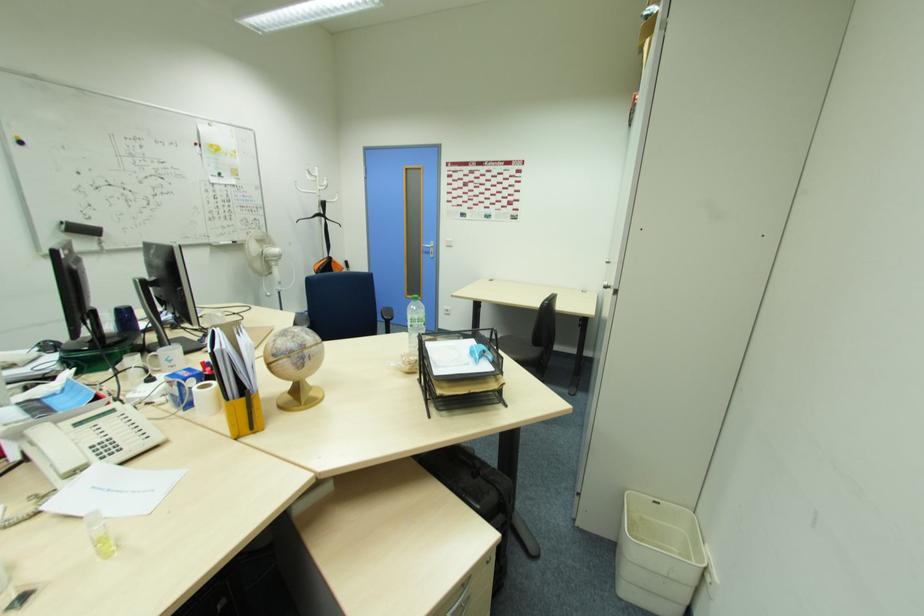
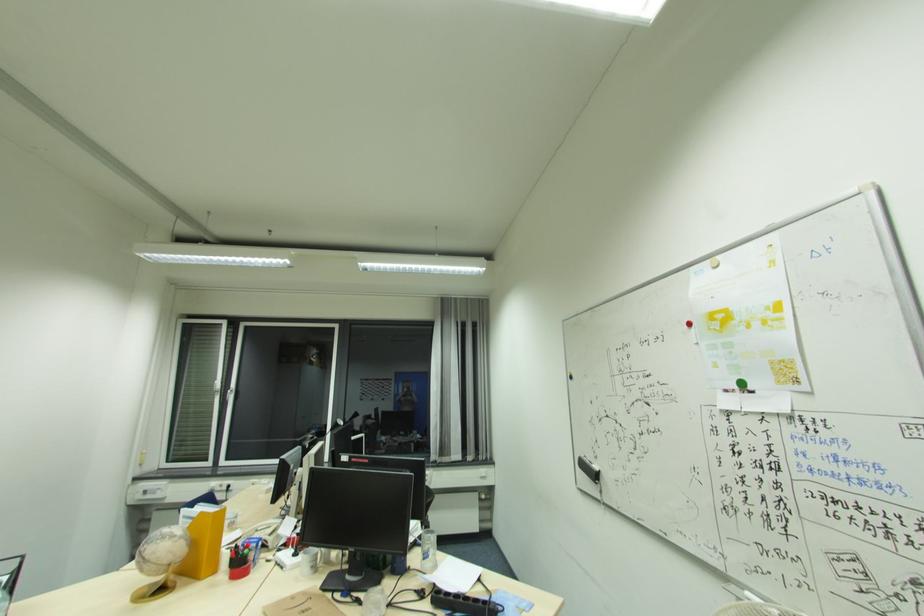
In the second image, find the point that corresponds to (220,176) in the first image.

(739, 387)